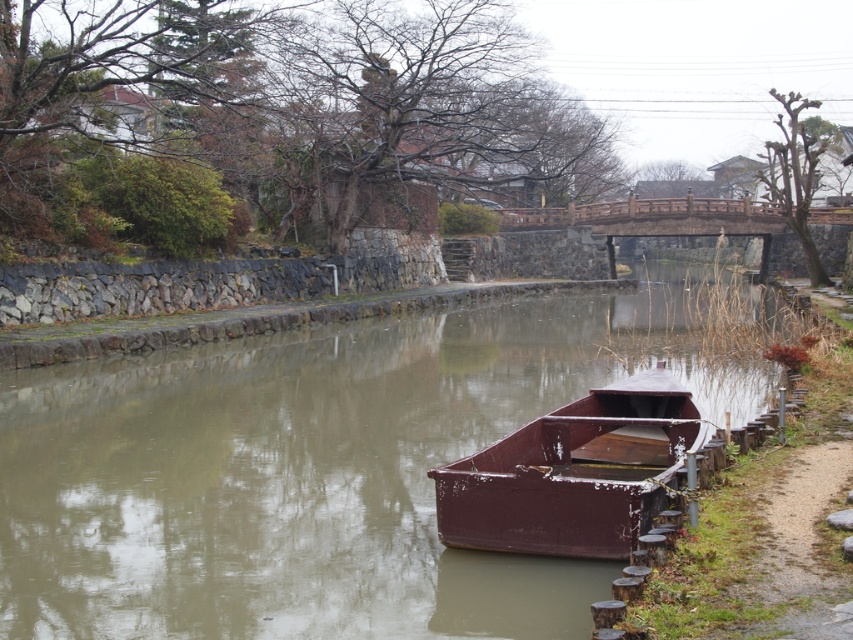
Question: Is smooth brown water at center thinner than rusty metal boat at center?

Choices:
 (A) yes
 (B) no

Answer: (B)

Question: Among these objects, which one is farthest from the camera?

Choices:
 (A) smooth brown water at center
 (B) rusty metal boat at center

Answer: (B)

Question: Which object appears farthest from the camera in this image?

Choices:
 (A) smooth brown water at center
 (B) rusty metal boat at center

Answer: (B)

Question: Is smooth brown water at center closer to camera compared to rusty metal boat at center?

Choices:
 (A) no
 (B) yes

Answer: (B)

Question: Does smooth brown water at center have a larger size compared to rusty metal boat at center?

Choices:
 (A) no
 (B) yes

Answer: (B)

Question: Which object is closer to the camera taking this photo?

Choices:
 (A) smooth brown water at center
 (B) rusty metal boat at center

Answer: (A)